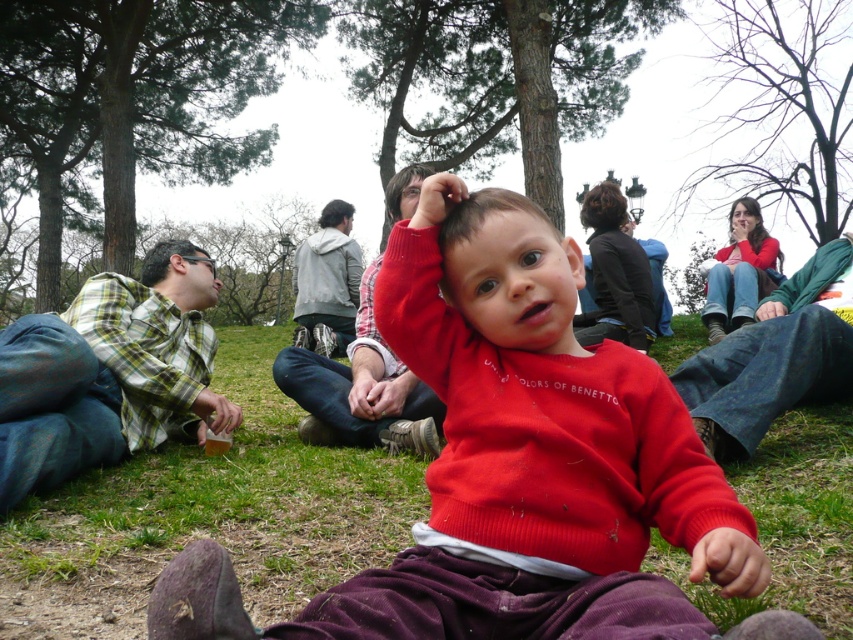
Question: Which of the following is the closest to the observer?

Choices:
 (A) (378, 429)
 (B) (115, 445)
 (C) (405, 497)
 (D) (296, 300)

Answer: (C)

Question: Which object appears closest to the camera in this image?

Choices:
 (A) gray fabric jacket at center
 (B) green grass at center
 (C) green plaid shirt at left
 (D) plaid fabric shirt at center

Answer: (D)

Question: Which object is positioned farthest from the green grass at center?

Choices:
 (A) green plaid shirt at left
 (B) plaid fabric shirt at center
 (C) gray fabric jacket at center

Answer: (C)

Question: Does green grass at center have a larger size compared to gray fabric jacket at center?

Choices:
 (A) no
 (B) yes

Answer: (A)

Question: Does green grass at center appear on the right side of gray fabric jacket at center?

Choices:
 (A) yes
 (B) no

Answer: (A)

Question: Can you confirm if green plaid shirt at left is smaller than plaid fabric shirt at center?

Choices:
 (A) yes
 (B) no

Answer: (A)